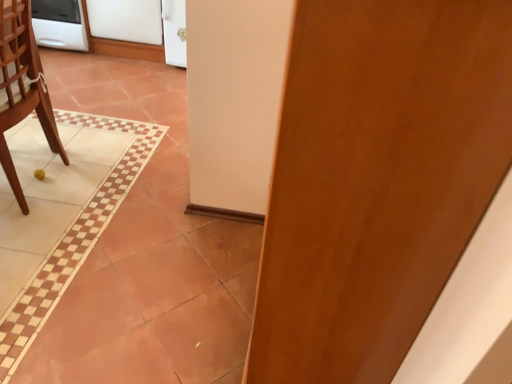
Question: Are white glossy oven at upper left and white glossy screen door at upper center, acting as the 1th screen door starting from the right, far apart?

Choices:
 (A) yes
 (B) no

Answer: (B)

Question: Is white glossy oven at upper left aimed at white glossy screen door at upper center, acting as the 1th screen door starting from the right?

Choices:
 (A) yes
 (B) no

Answer: (B)

Question: Is white glossy oven at upper left shorter than white glossy screen door at upper center, positioned as the second screen door in left-to-right order?

Choices:
 (A) no
 (B) yes

Answer: (B)

Question: From the image's perspective, is white glossy oven at upper left located above white glossy screen door at upper center, positioned as the second screen door in left-to-right order?

Choices:
 (A) no
 (B) yes

Answer: (B)

Question: Is white glossy oven at upper left in contact with white glossy screen door at upper center, acting as the 1th screen door starting from the right?

Choices:
 (A) yes
 (B) no

Answer: (B)

Question: Based on their positions, is white glossy oven at upper left located to the left or right of wooden door at center?

Choices:
 (A) right
 (B) left

Answer: (B)

Question: From a real-world perspective, is white glossy oven at upper left positioned above or below wooden door at center?

Choices:
 (A) above
 (B) below

Answer: (B)

Question: Looking at their shapes, would you say white glossy oven at upper left is wider or thinner than wooden door at center?

Choices:
 (A) wide
 (B) thin

Answer: (A)

Question: Considering the positions of white glossy oven at upper left and wooden door at center in the image, is white glossy oven at upper left taller or shorter than wooden door at center?

Choices:
 (A) tall
 (B) short

Answer: (B)

Question: Is white glossy oven at upper left inside or outside of wooden chair at left?

Choices:
 (A) outside
 (B) inside

Answer: (A)

Question: In terms of height, does white glossy oven at upper left look taller or shorter compared to wooden chair at left?

Choices:
 (A) short
 (B) tall

Answer: (A)

Question: From a real-world perspective, relative to wooden chair at left, is white glossy oven at upper left vertically above or below?

Choices:
 (A) above
 (B) below

Answer: (B)

Question: From the image's perspective, relative to wooden chair at left, is white glossy oven at upper left above or below?

Choices:
 (A) above
 (B) below

Answer: (A)

Question: In the image, is white matte refrigerator at upper left, which appears as the 1th screen door when viewed from the left, positioned in front of or behind white glossy screen door at upper center, acting as the 1th screen door starting from the right?

Choices:
 (A) front
 (B) behind

Answer: (B)

Question: Considering the positions of white matte refrigerator at upper left, which appears as the 1th screen door when viewed from the left, and white glossy screen door at upper center, acting as the 1th screen door starting from the right, in the image, is white matte refrigerator at upper left, which appears as the 1th screen door when viewed from the left, wider or thinner than white glossy screen door at upper center, acting as the 1th screen door starting from the right,?

Choices:
 (A) wide
 (B) thin

Answer: (B)